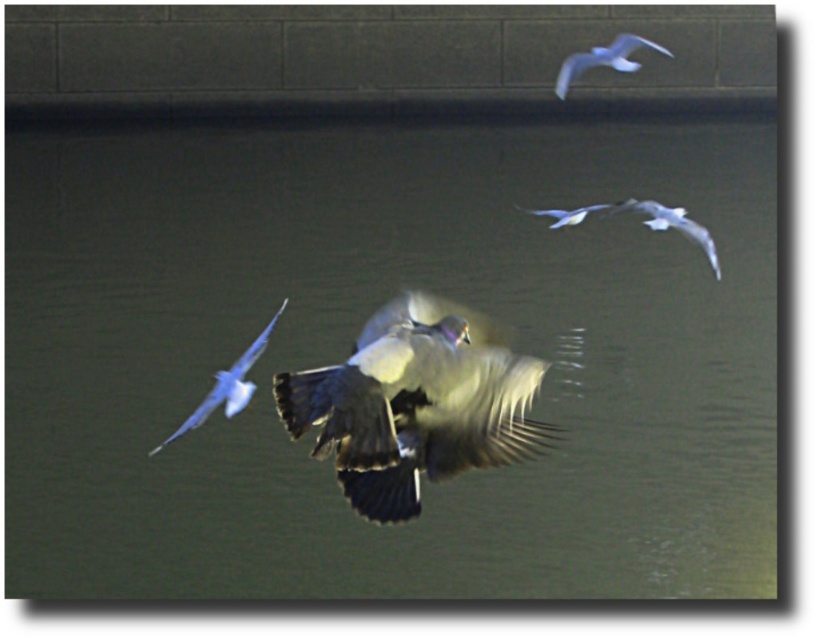
Is smooth water at center closer to the viewer compared to gray feathered bird at center?

No, it is behind gray feathered bird at center.

Which is more to the left, smooth water at center or gray feathered bird at center?

gray feathered bird at center is more to the left.

Between point (497, 152) and point (336, 410), which one is positioned in front?

Point (336, 410) is in front.

I want to click on smooth water at center, so click(351, 346).

Can you confirm if smooth water at center is positioned below white feathered bird at upper center?

Incorrect, smooth water at center is not positioned below white feathered bird at upper center.

Does point (74, 468) lie in front of point (601, 205)?

That is True.

Does point (466, 216) come farther from viewer compared to point (591, 211)?

Yes, point (466, 216) is behind point (591, 211).

At what (x,y) coordinates should I click in order to perform the action: click on smooth water at center. Please return your answer as a coordinate pair (x, y). Looking at the image, I should click on 351,346.

The width and height of the screenshot is (818, 640). What do you see at coordinates (416, 403) in the screenshot?
I see `gray feathered bird at center` at bounding box center [416, 403].

Does gray feathered bird at center appear over white feathered bird at upper right?

No.

This screenshot has width=818, height=640. Describe the element at coordinates (416, 403) in the screenshot. I see `gray feathered bird at center` at that location.

This screenshot has width=818, height=640. I want to click on gray feathered bird at center, so click(416, 403).